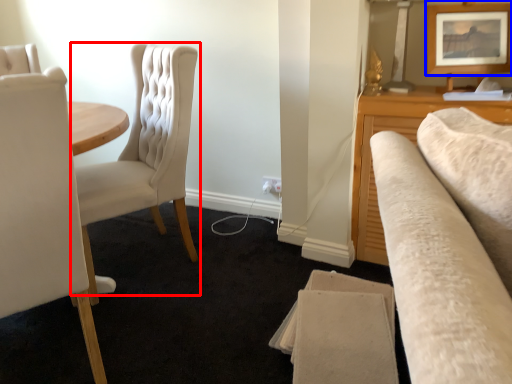
Question: Which point is further to the camera, chair (highlighted by a red box) or picture frame (highlighted by a blue box)?

Choices:
 (A) chair
 (B) picture frame

Answer: (B)